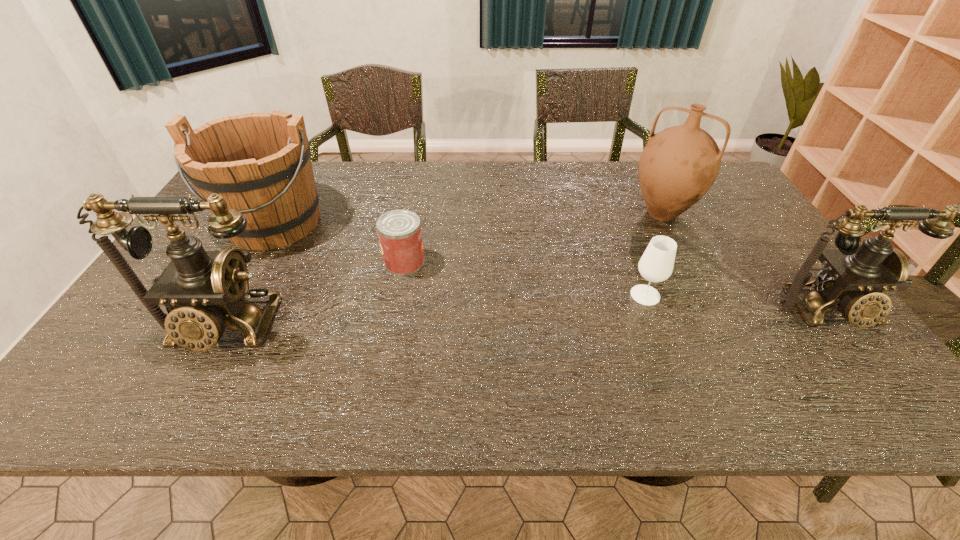
Identify which object is the closest to the pitcher. Please provide its 2D coordinates. Your answer should be formatted as a tuple, i.e. [(x, y)], where the tuple contains the x and y coordinates of a point satisfying the conditions above.

[(656, 264)]

Identify which object is the fifth nearest to the right telephone. Please provide its 2D coordinates. Your answer should be formatted as a tuple, i.e. [(x, y)], where the tuple contains the x and y coordinates of a point satisfying the conditions above.

[(260, 163)]

This screenshot has height=540, width=960. Identify the location of vacant position in the image that satisfies the following two spatial constraints: 1. on the side of the wine bucket with the handle for carrying; 2. on the left side of the glass. (234, 295).

Image resolution: width=960 pixels, height=540 pixels. Identify the location of free space that satisfies the following two spatial constraints: 1. on the side of the shortest object with the handle for carrying; 2. on the right side of the wine bucket. (252, 262).